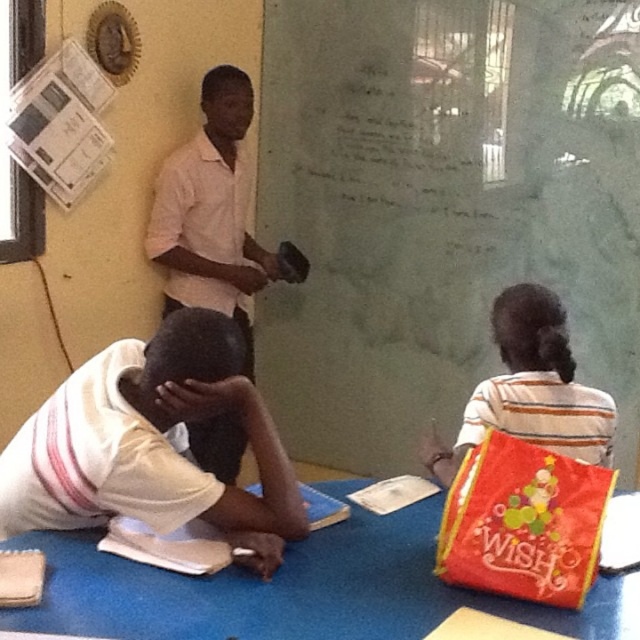
Question: Where is green matte chalkboard at center located in relation to blue fabric table at lower center in the image?

Choices:
 (A) below
 (B) above

Answer: (B)

Question: Among these objects, which one is nearest to the camera?

Choices:
 (A) striped fabric shirt at center
 (B) blue fabric table at lower center

Answer: (B)

Question: Which of the following is the closest to the observer?

Choices:
 (A) (204, 332)
 (B) (524, 433)
 (C) (358, 536)
 (D) (234, 243)

Answer: (A)

Question: Does green matte chalkboard at center appear over white shirt at upper center?

Choices:
 (A) no
 (B) yes

Answer: (B)

Question: Is white striped shirt at lower left above white shirt at upper center?

Choices:
 (A) yes
 (B) no

Answer: (B)

Question: Which point is farther to the camera?

Choices:
 (A) green matte chalkboard at center
 (B) blue fabric table at lower center

Answer: (A)